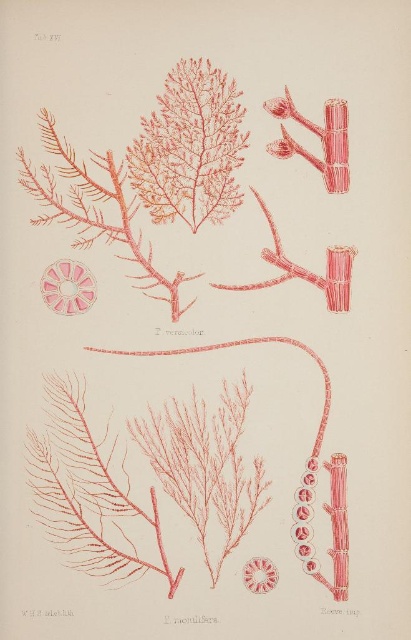
Question: Which point appears farthest from the camera in this image?

Choices:
 (A) (82, 268)
 (B) (346, 298)
 (C) (277, 253)

Answer: (C)

Question: Which of the following is the farthest from the observer?

Choices:
 (A) (286, 276)
 (B) (254, 566)
 (C) (149, 248)

Answer: (A)

Question: Does translucent pink coral at center appear under matte pink coral at center?

Choices:
 (A) yes
 (B) no

Answer: (B)

Question: Which point is farther to the camera?

Choices:
 (A) (249, 586)
 (B) (219, 161)
 (C) (187, 276)
 (D) (304, 348)

Answer: (C)

Question: Is the position of matte pink seaweed at upper center more distant than that of pink translucent flower at center?

Choices:
 (A) no
 (B) yes

Answer: (A)

Question: Can you confirm if matte pink seaweed at upper center is positioned to the right of pink matte branch at upper left?

Choices:
 (A) no
 (B) yes

Answer: (B)